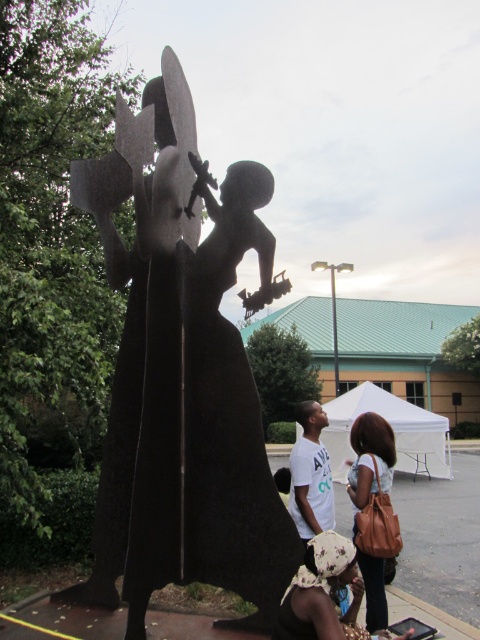
Based on the photo, you are an artist trying to place a matte brown purse at lower center near the black matte sculpture at center for a photo shoot. Since you want the sculpture to be the main focus, will the size difference between them make the sculpture stand out more?

The black matte sculpture at center has a larger size compared to the matte brown purse at lower center, so yes, the sculpture will stand out more as the main focus due to its bigger size.

You are standing in the outdoor area and see the black matte sculpture at center and the brown leather purse at lower center. Which object is higher up in the scene?

The black matte sculpture at center is above the brown leather purse at lower center, so it is higher up in the scene.